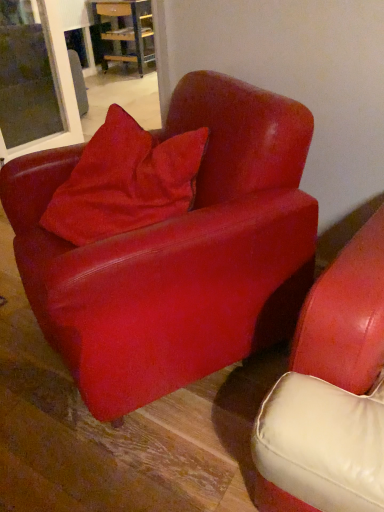
Question: From a real-world perspective, is velvet red pillow at center physically located above or below wooden table at center?

Choices:
 (A) below
 (B) above

Answer: (B)

Question: From the image's perspective, is velvet red pillow at center positioned above or below wooden table at center?

Choices:
 (A) below
 (B) above

Answer: (A)

Question: Estimate the real-world distances between objects in this image. Which object is farther from the velvet red pillow at center?

Choices:
 (A) transparent glass window at upper left
 (B) wooden table at center
 (C) matte red armchair at center

Answer: (B)

Question: Which object is the farthest from the transparent glass window at upper left?

Choices:
 (A) wooden table at center
 (B) matte red armchair at center
 (C) velvet red pillow at center

Answer: (A)